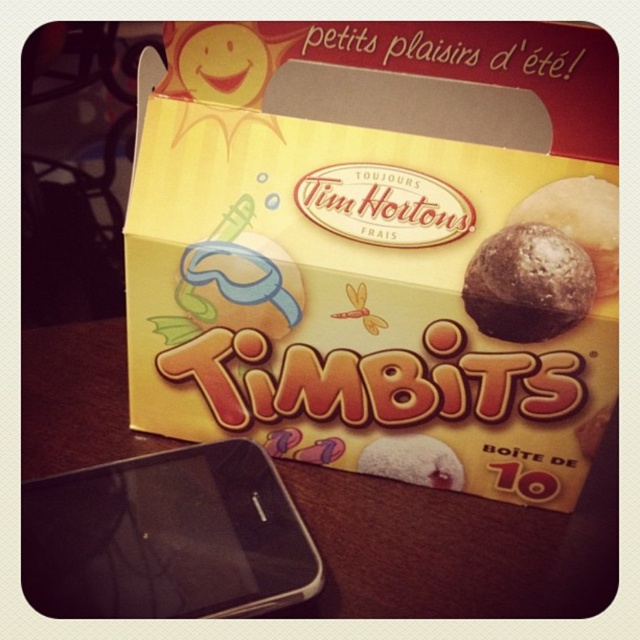
Does chocolate-coated ball at center have a larger size compared to dark chocolate cookie at center?

Correct, chocolate-coated ball at center is larger in size than dark chocolate cookie at center.

Is chocolate-coated ball at center positioned before dark chocolate cookie at center?

No, it is behind dark chocolate cookie at center.

This screenshot has width=640, height=640. Describe the element at coordinates (528, 284) in the screenshot. I see `chocolate-coated ball at center` at that location.

You are a GUI agent. You are given a task and a screenshot of the screen. Output one action in this format:
    pyautogui.click(x=<x>, y=<y>)
    Task: Click on the chocolate-coated ball at center
    This screenshot has width=640, height=640.
    Given the screenshot: What is the action you would take?
    pyautogui.click(x=528, y=284)

Between wooden table at center and chocolate-coated ball at center, which one is positioned lower?

Positioned lower is wooden table at center.

Does point (336, 481) come farther from viewer compared to point (545, 230)?

That is True.

Where is `wooden table at center`? The width and height of the screenshot is (640, 640). wooden table at center is located at coordinates (456, 547).

Locate an element on the screen. wooden table at center is located at coordinates (456, 547).

Between black glossy smartphone at lower left and chocolate-coated ball at center, which one has more height?

Standing taller between the two is black glossy smartphone at lower left.

Who is more forward, [147,612] or [492,332]?

Point [147,612] is more forward.

Which is behind, point (131, 524) or point (524, 300)?

The point (524, 300) is behind.

This screenshot has height=640, width=640. I want to click on black glossy smartphone at lower left, so click(166, 538).